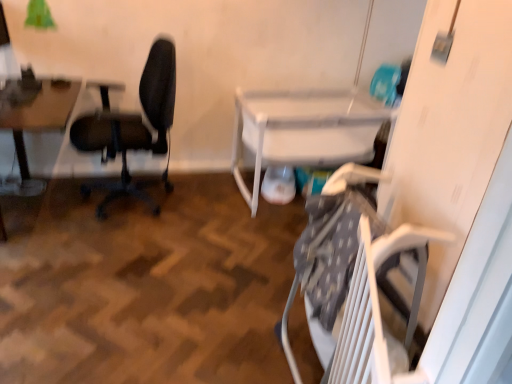
Question: Is wooden table at left, arranged as the first table when viewed from the left, bigger or smaller than black matte office chair at left?

Choices:
 (A) big
 (B) small

Answer: (B)

Question: In terms of width, does wooden table at left, which appears as the 2th table when viewed from the right, look wider or thinner when compared to black matte office chair at left?

Choices:
 (A) thin
 (B) wide

Answer: (A)

Question: Estimate the real-world distances between objects in this image. Which object is farther from the black matte office chair at left?

Choices:
 (A) wooden table at left, which appears as the 2th table when viewed from the right
 (B) white plastic table at lower right, which appears as the 2th table when viewed from the left

Answer: (B)

Question: Estimate the real-world distances between objects in this image. Which object is farther from the wooden table at left, arranged as the first table when viewed from the left?

Choices:
 (A) white plastic table at lower right, which is counted as the first table, starting from the right
 (B) black matte office chair at left

Answer: (A)